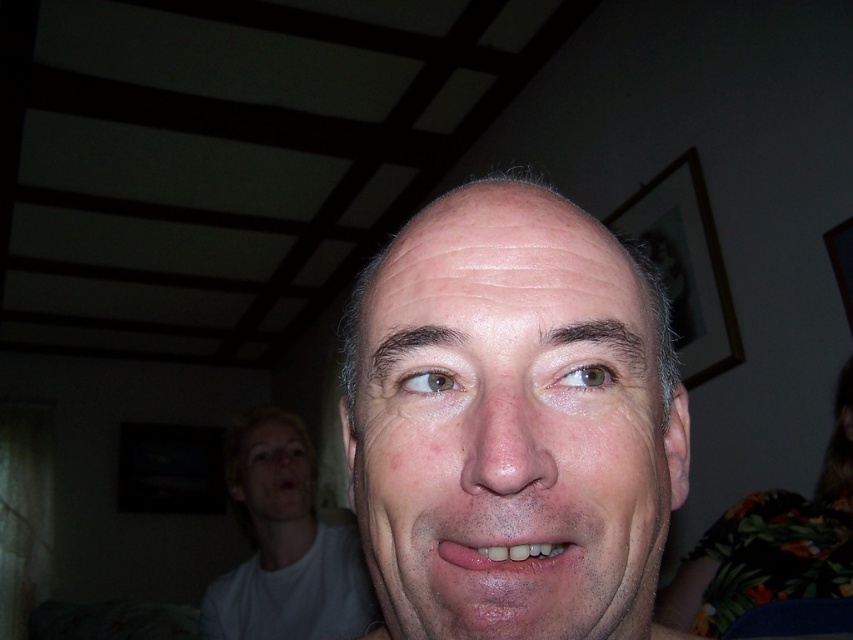
Consider the image. Based on the scene description, which object is taller between the smooth skin face at center and the pink matte lips at center?

The smooth skin face at center is much taller than the pink matte lips at center.

Consider the image. You are taking a photo of the main subject and want to focus on the point at the lower right corner of their face. Which point, point (273, 420) or point (445, 550), is closer to the camera and should be focused on?

Point (273, 420) is further to the camera than point (445, 550), so you should focus on point (445, 550) as it is closer to the camera.